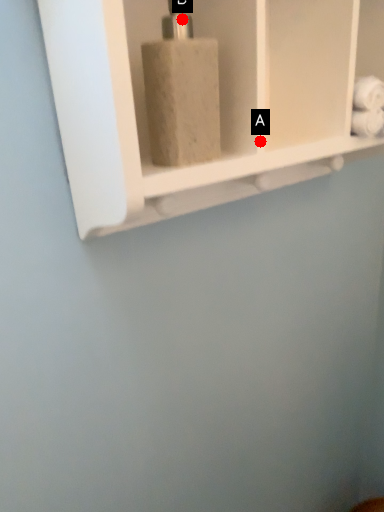
Question: Two points are circled on the image, labeled by A and B beside each circle. Which point appears farthest from the camera in this image?

Choices:
 (A) A is further
 (B) B is further

Answer: (A)